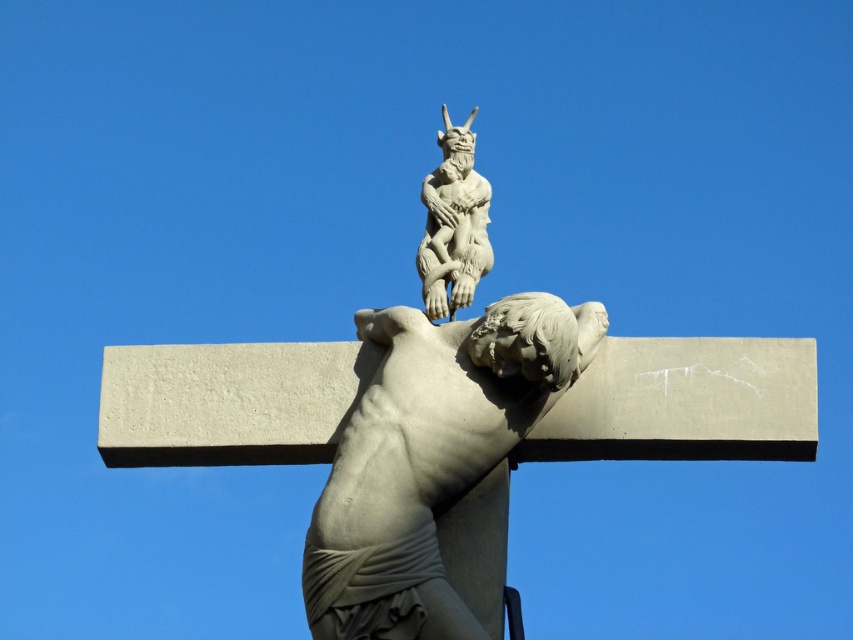
You are an art student analyzing the sculpture. You notice two figures on the crucifixion scene. The white stone crucifix at center and the white stone gargoyle at upper center. Which one is taller?

The white stone gargoyle at upper center is taller than the white stone crucifix at center.

You are an art student analyzing the composition of the sculpture. You notice the white stone crucifix at center and the white stone gargoyle at upper center. Which object is located to the left of the other?

The white stone crucifix at center is positioned on the left side of white stone gargoyle at upper center.

You are a visitor at a museum and see the white stone cross at center and the white stone crucifix at center. Which one is placed higher up?

The white stone cross at center is positioned over the white stone crucifix at center, so the white stone cross at center is placed higher up.